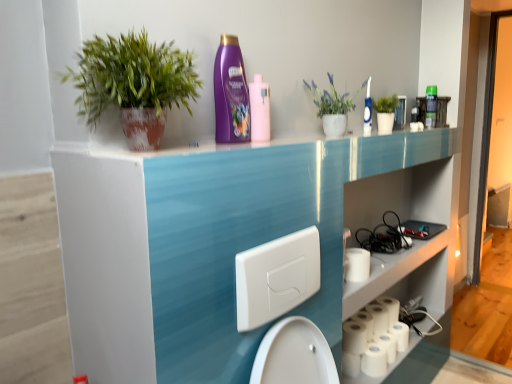
Question: Is white matte toilet paper at lower right, which is the first toilet paper in right-to-left order, in front of or behind purple glossy shampoo at upper center, placed as the 1th cleaning product when sorted from left to right, in the image?

Choices:
 (A) behind
 (B) front

Answer: (A)

Question: Based on their positions, is white matte toilet paper at lower right, which ranks as the fourth toilet paper in left-to-right order, located to the left or right of purple glossy shampoo at upper center, the fourth cleaning product viewed from the right?

Choices:
 (A) right
 (B) left

Answer: (A)

Question: Which of these objects is positioned closest to the white matte toilet paper at lower right, which is the first toilet paper in right-to-left order?

Choices:
 (A) white textured pot at upper center, arranged as the first houseplant when viewed from the right
 (B) green matte plant at upper left, the first houseplant from the left
 (C) matte green spray bottle at upper right, which is the fourth cleaning product from left to right
 (D) white matte toilet paper at lower right, which appears as the second toilet paper when viewed from the left
 (E) white matte toilet paper at lower right, marked as the second toilet paper in a right-to-left arrangement

Answer: (E)

Question: Which of these objects is positioned closest to the blue plastic toothbrush at upper right, positioned as the 2th cleaning product in right-to-left order?

Choices:
 (A) white matte toilet paper at lower right, marked as the second toilet paper in a right-to-left arrangement
 (B) purple glossy shampoo at upper center, the fourth cleaning product viewed from the right
 (C) matte green spray bottle at upper right, the 1th cleaning product in the back-to-front sequence
 (D) white matte toilet paper at lower right, which is the first toilet paper in right-to-left order
 (E) white textured pot at upper center, which appears as the 2th houseplant when viewed from the left

Answer: (E)